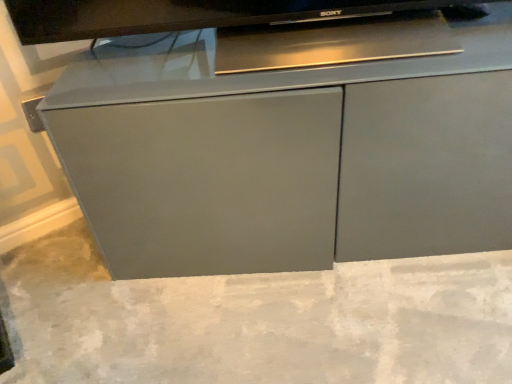
Question: Can you confirm if gray concrete at center is smaller than matte gray cabinet at center?

Choices:
 (A) no
 (B) yes

Answer: (B)

Question: Would you say gray concrete at center is outside matte gray cabinet at center?

Choices:
 (A) yes
 (B) no

Answer: (A)

Question: Is gray concrete at center oriented towards matte gray cabinet at center?

Choices:
 (A) yes
 (B) no

Answer: (B)

Question: From the image's perspective, is gray concrete at center located beneath matte gray cabinet at center?

Choices:
 (A) no
 (B) yes

Answer: (B)

Question: Would you say gray concrete at center contains matte gray cabinet at center?

Choices:
 (A) no
 (B) yes

Answer: (A)

Question: From a real-world perspective, is gray concrete at center located beneath matte gray cabinet at center?

Choices:
 (A) yes
 (B) no

Answer: (A)

Question: From the image's perspective, is matte gray cabinet at center located above gray concrete at center?

Choices:
 (A) no
 (B) yes

Answer: (B)

Question: Considering the relative sizes of matte gray cabinet at center and gray concrete at center in the image provided, is matte gray cabinet at center thinner than gray concrete at center?

Choices:
 (A) no
 (B) yes

Answer: (B)

Question: Does matte gray cabinet at center have a greater width compared to gray concrete at center?

Choices:
 (A) yes
 (B) no

Answer: (B)

Question: Does matte gray cabinet at center have a greater height compared to gray concrete at center?

Choices:
 (A) no
 (B) yes

Answer: (B)

Question: Is the surface of matte gray cabinet at center in direct contact with gray concrete at center?

Choices:
 (A) no
 (B) yes

Answer: (A)

Question: Is gray concrete at center inside matte gray cabinet at center?

Choices:
 (A) no
 (B) yes

Answer: (A)

Question: From the image's perspective, is gray concrete at center located above or below matte gray cabinet at center?

Choices:
 (A) above
 (B) below

Answer: (B)